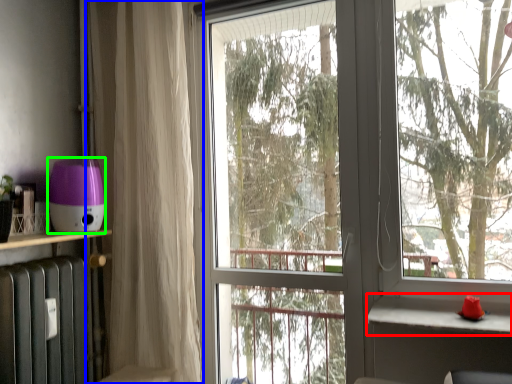
Question: Which object is positioned closest to window sill (highlighted by a red box)? Select from curtain (highlighted by a blue box) and appliance (highlighted by a green box).

Choices:
 (A) curtain
 (B) appliance

Answer: (A)